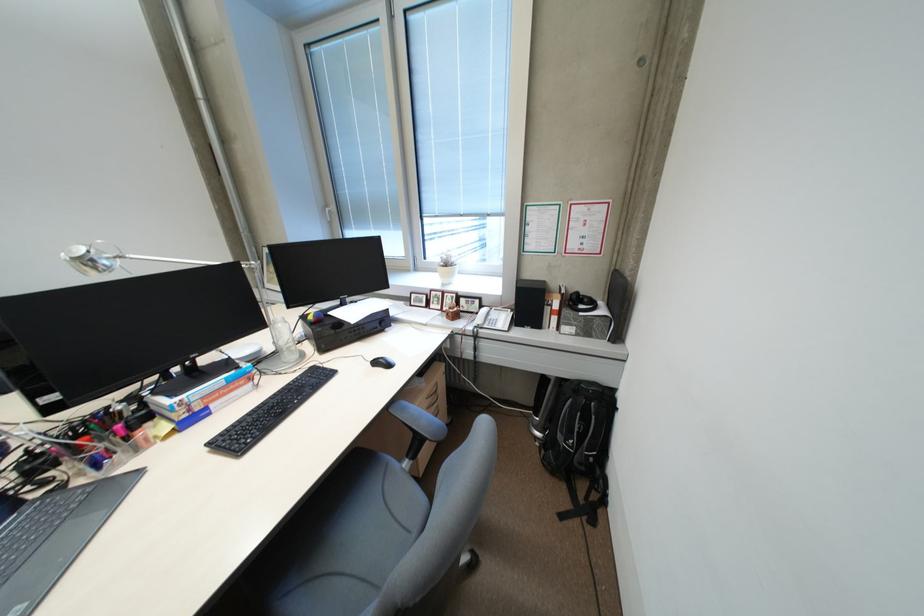
The width and height of the screenshot is (924, 616). I want to click on black backpack, so click(579, 445).